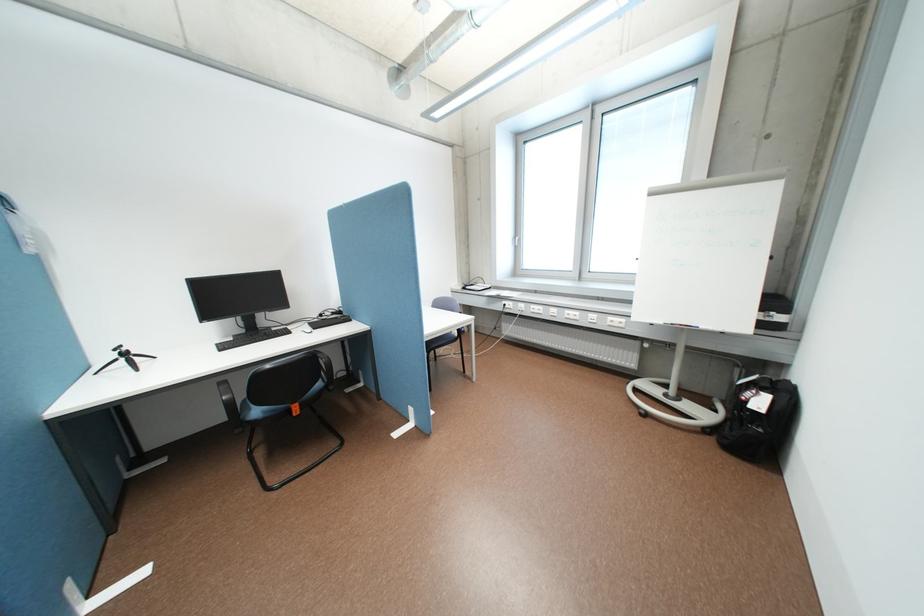
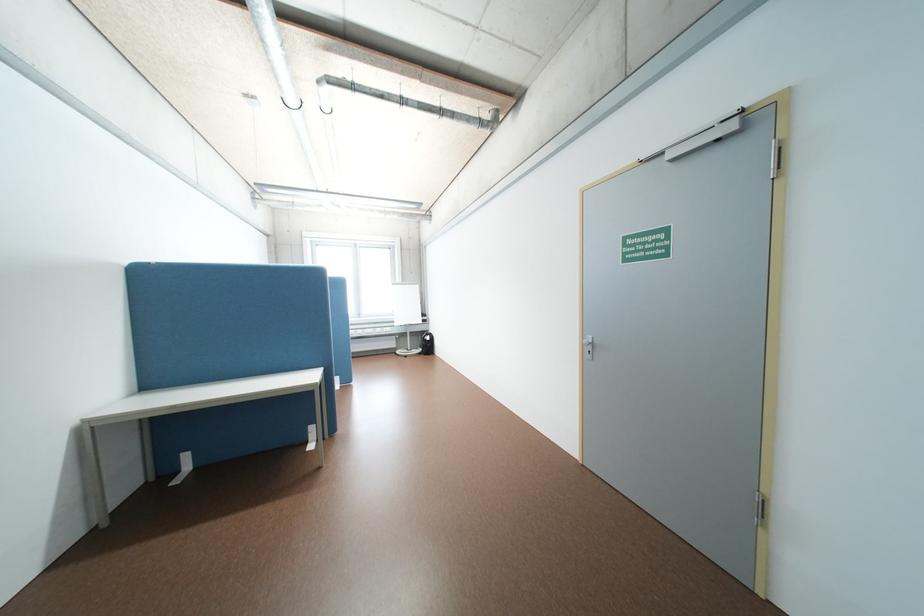
Locate, in the second image, the point that corresponds to point (718, 430) in the first image.

(431, 353)